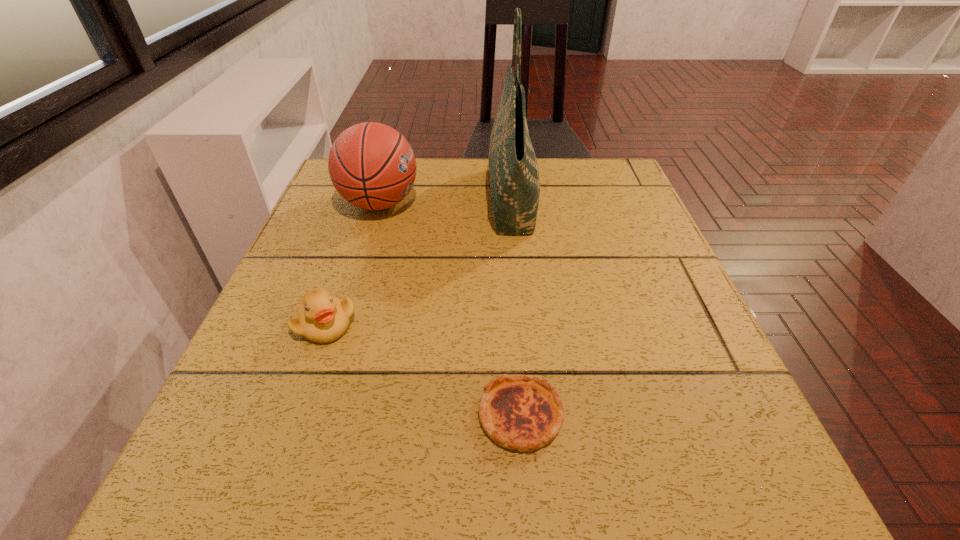
Locate an element on the screen. This screenshot has height=540, width=960. empty space between the tallest object and the duckling is located at coordinates (419, 262).

At what (x,y) coordinates should I click in order to perform the action: click on vacant area that lies between the tote bag and the second shortest object. Please return your answer as a coordinate pair (x, y). The width and height of the screenshot is (960, 540). Looking at the image, I should click on (419, 262).

Where is `vacant area that lies between the shortest object and the tallest object`? This screenshot has height=540, width=960. vacant area that lies between the shortest object and the tallest object is located at coordinates (516, 307).

This screenshot has height=540, width=960. I want to click on the second closest object relative to the third farthest object, so click(371, 165).

You are a GUI agent. You are given a task and a screenshot of the screen. Output one action in this format:
    pyautogui.click(x=<x>, y=<y>)
    Task: Click on the object that is the third closest one to the third tallest object
    Image resolution: width=960 pixels, height=540 pixels.
    Given the screenshot: What is the action you would take?
    pyautogui.click(x=514, y=174)

Where is `free space that satisfies the following two spatial constraints: 1. on the logo side of the third shortest object; 2. on the beak of the duckling`? free space that satisfies the following two spatial constraints: 1. on the logo side of the third shortest object; 2. on the beak of the duckling is located at coordinates (342, 324).

Identify the location of free point that satisfies the following two spatial constraints: 1. on the logo side of the basketball; 2. on the beak of the duckling. This screenshot has width=960, height=540. pyautogui.click(x=342, y=324).

You are a GUI agent. You are given a task and a screenshot of the screen. Output one action in this format:
    pyautogui.click(x=<x>, y=<y>)
    Task: Click on the free location that satisfies the following two spatial constraints: 1. on the beak of the nearest object; 2. on the right side of the duckling
    The image size is (960, 540).
    Given the screenshot: What is the action you would take?
    pyautogui.click(x=294, y=415)

Where is `vacant area that satisfies the following two spatial constraints: 1. on the beak of the quiche; 2. on the right side of the third farthest object`? This screenshot has width=960, height=540. vacant area that satisfies the following two spatial constraints: 1. on the beak of the quiche; 2. on the right side of the third farthest object is located at coordinates (294, 415).

I want to click on free space that satisfies the following two spatial constraints: 1. on the beak of the second shortest object; 2. on the right side of the nearest object, so click(x=294, y=415).